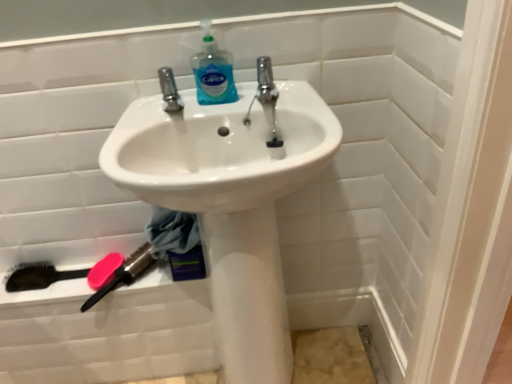
Question: From a real-world perspective, is pink plastic brush at lower left, the second brush viewed from the left, under white glossy sink at center?

Choices:
 (A) yes
 (B) no

Answer: (A)

Question: From a real-world perspective, is pink plastic brush at lower left, the second brush viewed from the left, located higher than white glossy sink at center?

Choices:
 (A) no
 (B) yes

Answer: (A)

Question: Is pink plastic brush at lower left, the second brush viewed from the left, thinner than white glossy sink at center?

Choices:
 (A) yes
 (B) no

Answer: (A)

Question: Would you say white glossy sink at center is part of pink plastic brush at lower left, the first brush when ordered from right to left,'s contents?

Choices:
 (A) yes
 (B) no

Answer: (B)

Question: Is pink plastic brush at lower left, the second brush viewed from the left, outside white glossy sink at center?

Choices:
 (A) no
 (B) yes

Answer: (B)

Question: Is pink plastic brush at lower left, the first brush when ordered from right to left, at the right side of white glossy sink at center?

Choices:
 (A) yes
 (B) no

Answer: (B)

Question: Considering the relative sizes of black bristle brush at lower left, placed as the 2th brush when sorted from right to left, and white glossy sink at center in the image provided, is black bristle brush at lower left, placed as the 2th brush when sorted from right to left, shorter than white glossy sink at center?

Choices:
 (A) no
 (B) yes

Answer: (B)

Question: Does black bristle brush at lower left, placed as the 1th brush when sorted from left to right, touch white glossy sink at center?

Choices:
 (A) yes
 (B) no

Answer: (B)

Question: From a real-world perspective, does black bristle brush at lower left, placed as the 2th brush when sorted from right to left, stand above white glossy sink at center?

Choices:
 (A) yes
 (B) no

Answer: (B)

Question: From a real-world perspective, is black bristle brush at lower left, placed as the 1th brush when sorted from left to right, positioned under white glossy sink at center based on gravity?

Choices:
 (A) no
 (B) yes

Answer: (B)

Question: From the image's perspective, is black bristle brush at lower left, placed as the 2th brush when sorted from right to left, beneath white glossy sink at center?

Choices:
 (A) no
 (B) yes

Answer: (B)

Question: Does black bristle brush at lower left, placed as the 1th brush when sorted from left to right, have a smaller size compared to white glossy sink at center?

Choices:
 (A) no
 (B) yes

Answer: (B)

Question: Is blue translucent liquid at upper center oriented towards black bristle brush at lower left, placed as the 2th brush when sorted from right to left?

Choices:
 (A) yes
 (B) no

Answer: (B)